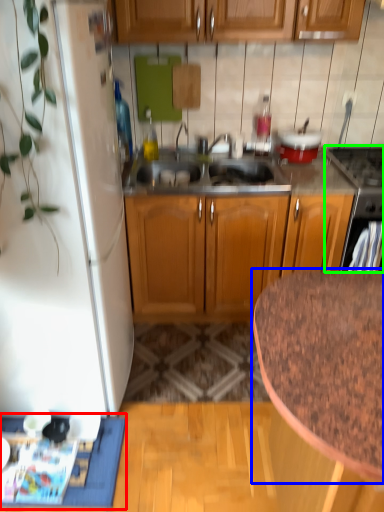
Question: Which object is the closest to the doormat (highlighted by a red box)? Choose among these: countertop (highlighted by a blue box) or appliance (highlighted by a green box).

Choices:
 (A) countertop
 (B) appliance

Answer: (A)